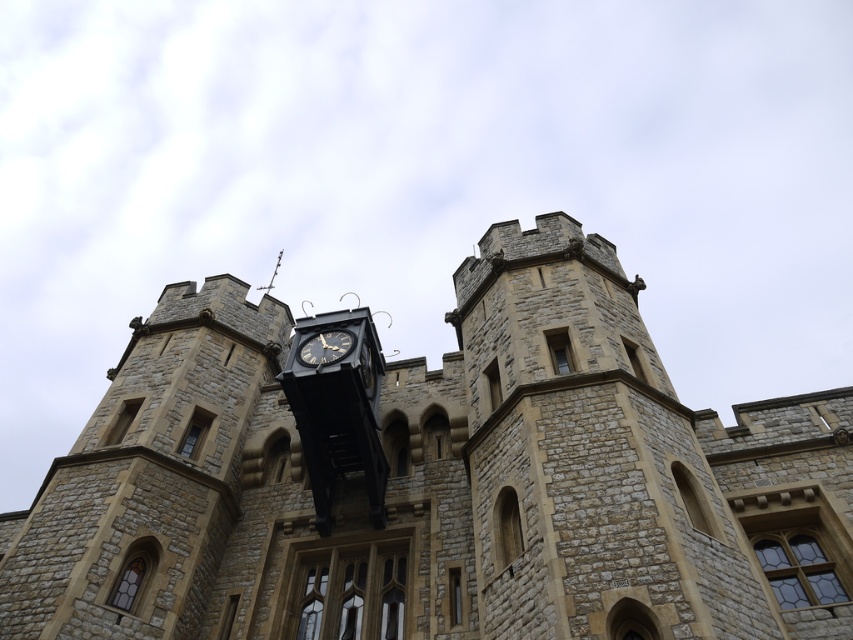
Is stone clock tower at center shorter than black metal clock at center?

In fact, stone clock tower at center may be taller than black metal clock at center.

Is stone clock tower at center in front of black metal clock at center?

Yes, it is.

Does point (271, 506) come behind point (320, 355)?

That is True.

Identify the location of stone clock tower at center. The image size is (853, 640). (434, 477).